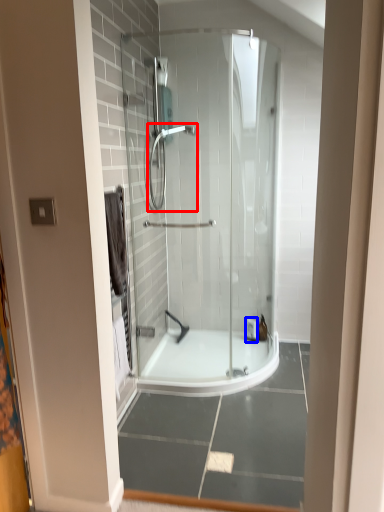
Question: Which point is further to the camera, shower (highlighted by a red box) or toiletry (highlighted by a blue box)?

Choices:
 (A) shower
 (B) toiletry

Answer: (B)